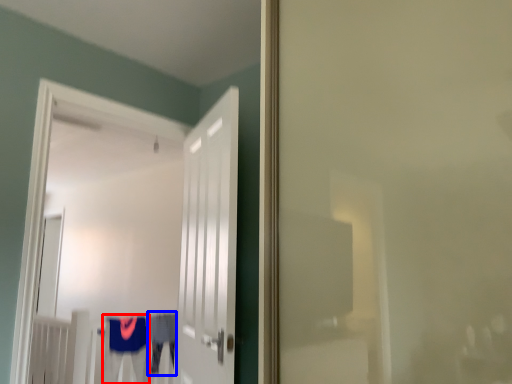
Question: Which object is further to the camera taking this photo, robe (highlighted by a red box) or robe (highlighted by a blue box)?

Choices:
 (A) robe
 (B) robe

Answer: (B)